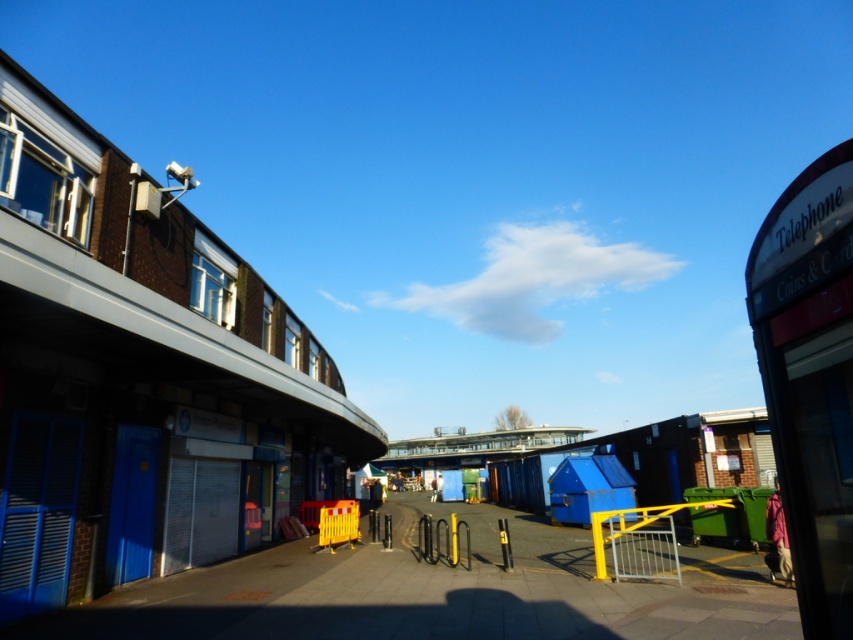
Question: Which point is farther to the camera?

Choices:
 (A) (438, 440)
 (B) (814, 579)

Answer: (A)

Question: Does blue corrugated metal beach hut at left have a lesser width compared to blue metallic bridge at center?

Choices:
 (A) no
 (B) yes

Answer: (B)

Question: Estimate the real-world distances between objects in this image. Which object is farther from the blue metallic bridge at center?

Choices:
 (A) blue corrugated metal beach hut at left
 (B) white plastic telephone booth at right

Answer: (B)

Question: Which point is farther from the camera taking this photo?

Choices:
 (A) (122, 493)
 (B) (514, 435)
 (C) (848, 369)

Answer: (B)

Question: Can you confirm if blue corrugated metal beach hut at left is wider than blue metallic bridge at center?

Choices:
 (A) yes
 (B) no

Answer: (B)

Question: Is blue corrugated metal beach hut at left to the right of white plastic telephone booth at right from the viewer's perspective?

Choices:
 (A) yes
 (B) no

Answer: (B)